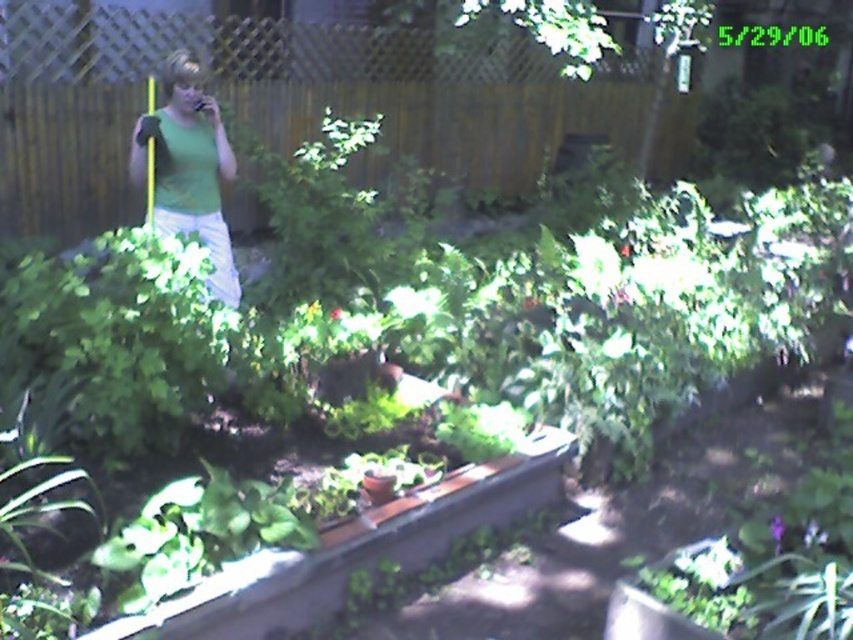
Can you confirm if green leafy plant at center is taller than green leafy plant at lower right?

Indeed, green leafy plant at center has a greater height compared to green leafy plant at lower right.

Who is positioned more to the left, green leafy plant at center or green leafy plant at lower right?

green leafy plant at center is more to the left.

Locate an element on the screen. green leafy plant at center is located at coordinates (357, 550).

Is green matte shirt at upper left below green leafy plant at lower right?

No, green matte shirt at upper left is not below green leafy plant at lower right.

In order to click on green matte shirt at upper left in this screenshot , I will do `click(189, 168)`.

At what (x,y) coordinates should I click in order to perform the action: click on green matte shirt at upper left. Please return your answer as a coordinate pair (x, y). This screenshot has width=853, height=640. Looking at the image, I should click on (189, 168).

Does green leafy plant at center lie in front of green matte shirt at upper left?

Yes, green leafy plant at center is closer to the viewer.

Is green leafy plant at center below green matte shirt at upper left?

Indeed, green leafy plant at center is positioned under green matte shirt at upper left.

Consider the image. Who is more forward, (x=372, y=522) or (x=154, y=147)?

Positioned in front is point (x=372, y=522).

At what (x,y) coordinates should I click in order to perform the action: click on green leafy plant at center. Please return your answer as a coordinate pair (x, y). The width and height of the screenshot is (853, 640). Looking at the image, I should click on click(x=357, y=550).